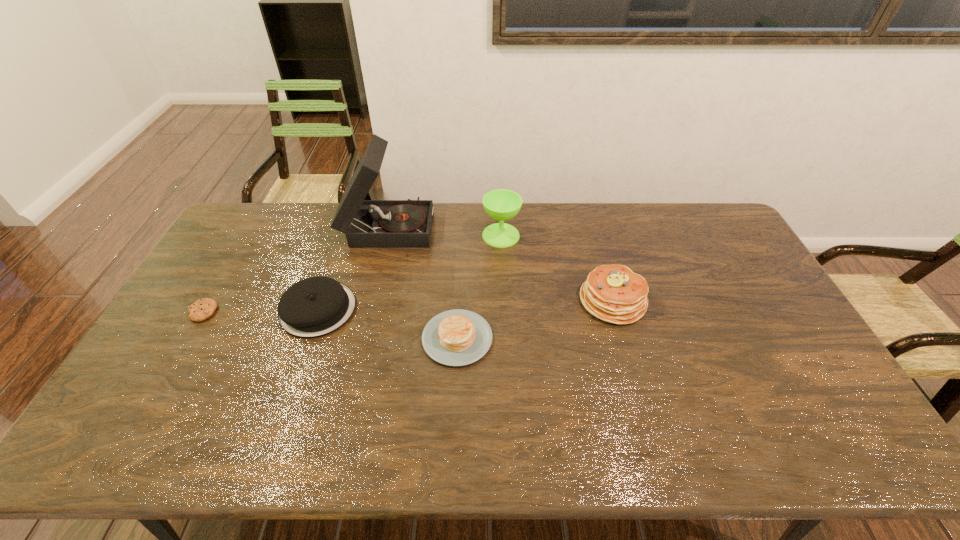
Where is `vacant point that satisfies the following two spatial constraints: 1. on the back side of the shortest pancake; 2. on the right side of the wineglass`? vacant point that satisfies the following two spatial constraints: 1. on the back side of the shortest pancake; 2. on the right side of the wineglass is located at coordinates (462, 235).

The height and width of the screenshot is (540, 960). What are the coordinates of `vacant area that satisfies the following two spatial constraints: 1. on the front-facing side of the tallest object; 2. on the front side of the second tallest pancake` in the screenshot? It's located at point(369,309).

Identify the location of free space that satisfies the following two spatial constraints: 1. on the back side of the wineglass; 2. on the right side of the cookie. This screenshot has height=540, width=960. (248, 235).